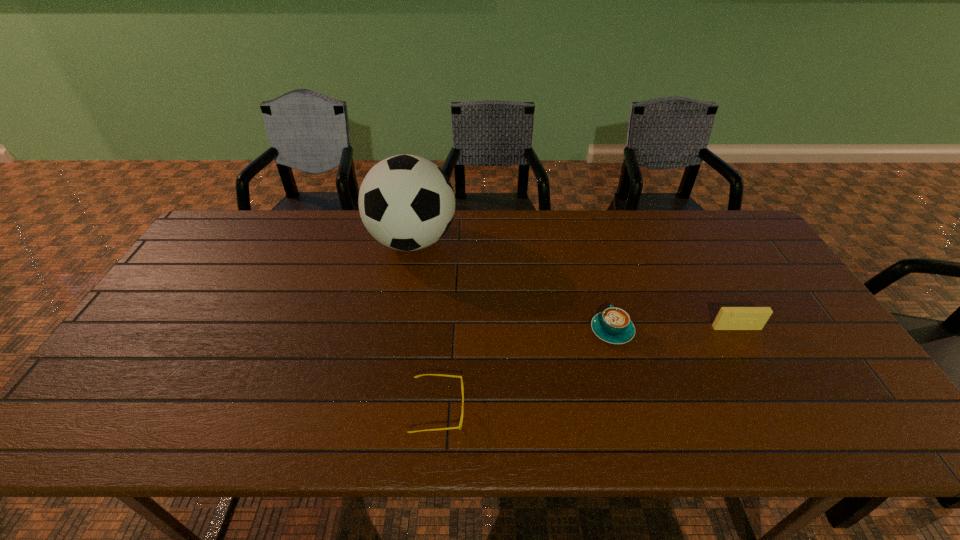
Identify the location of the farthest object. This screenshot has height=540, width=960. (406, 202).

Identify the location of soccer ball. (406, 202).

Find the location of a particular element. This screenshot has height=540, width=960. the rightmost object is located at coordinates (728, 318).

Where is `the second tallest object`? the second tallest object is located at coordinates (728, 318).

The height and width of the screenshot is (540, 960). I want to click on the second shortest object, so click(x=613, y=325).

Where is `cappuccino`? The image size is (960, 540). cappuccino is located at coordinates (613, 325).

Where is `the shortest object`? This screenshot has width=960, height=540. the shortest object is located at coordinates (459, 427).

Find the location of a particular element. The image size is (960, 540). the nearest object is located at coordinates (459, 427).

Locate an element on the screen. This screenshot has height=540, width=960. vacant space located 0.170m on the right of the farthest object is located at coordinates (509, 241).

Identify the location of vacant space situated 0.170m at the front of the videotape with spools. (769, 386).